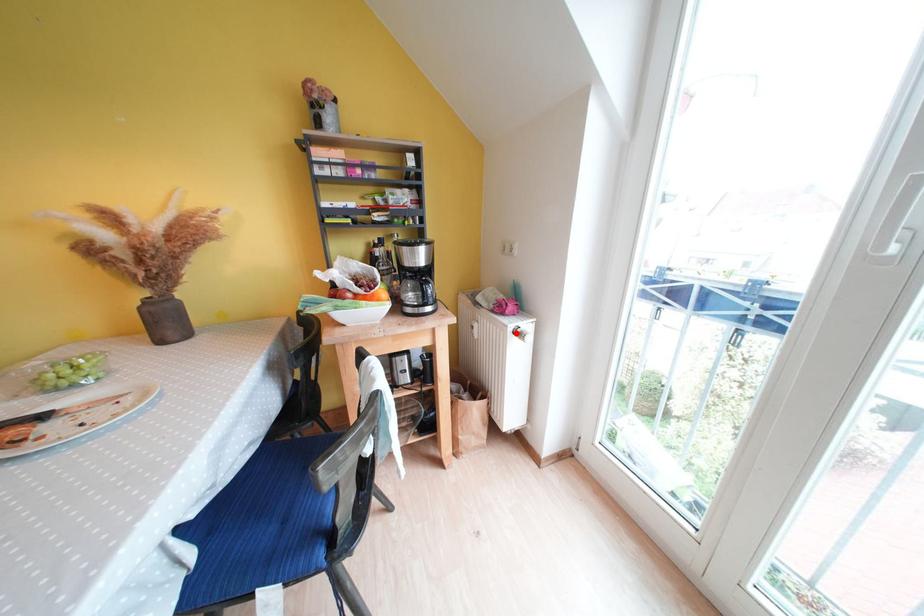
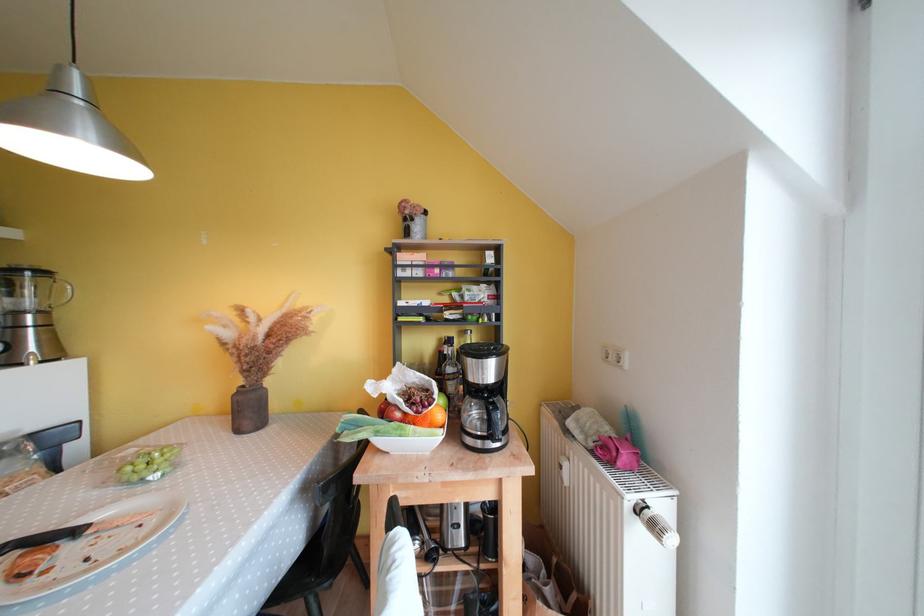
In the second image, find the point that corresponds to the highlighted location in the first image.

(634, 509)